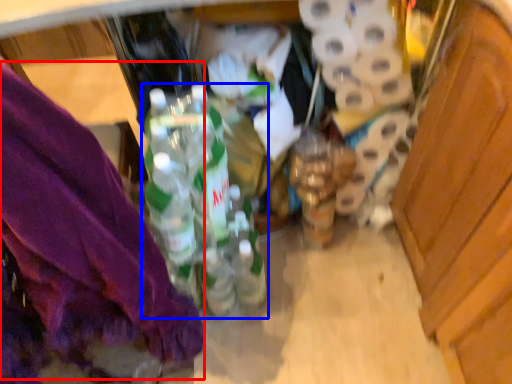
Question: Among these objects, which one is nearest to the camera, underclothes (highlighted by a red box) or bottle (highlighted by a blue box)?

Choices:
 (A) underclothes
 (B) bottle

Answer: (A)